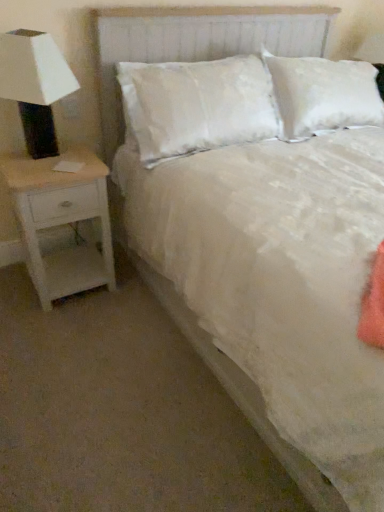
This screenshot has width=384, height=512. Describe the element at coordinates (194, 42) in the screenshot. I see `white textured headboard at center` at that location.

What is the approximate height of white matte lamp at left?

white matte lamp at left is 20.59 inches in height.

What do you see at coordinates (61, 220) in the screenshot? The width and height of the screenshot is (384, 512). I see `white wood nightstand at left` at bounding box center [61, 220].

Where is `white textured headboard at center`? white textured headboard at center is located at coordinates (194, 42).

Could you tell me if white wood nightstand at left is facing white textured headboard at center?

No, white wood nightstand at left is not turned towards white textured headboard at center.

From the image's perspective, which is below, white wood nightstand at left or white textured headboard at center?

From the image's view, white wood nightstand at left is below.

Is white wood nightstand at left thinner than white textured headboard at center?

No, white wood nightstand at left is not thinner than white textured headboard at center.

What's the angular difference between white wood nightstand at left and white textured headboard at center's facing directions?

The angle between the facing direction of white wood nightstand at left and the facing direction of white textured headboard at center is 0.00156 degrees.

Is point (44, 79) positioned before point (118, 118)?

Yes, it is.

Is white matte lamp at left smaller than white textured headboard at center?

Indeed, white matte lamp at left has a smaller size compared to white textured headboard at center.

Relative to white textured headboard at center, is white matte lamp at left in front or behind?

white matte lamp at left is positioned closer to the viewer than white textured headboard at center.

Between white textured headboard at center and white wood nightstand at left, which one has less height?

white wood nightstand at left.

Is point (143, 9) more distant than point (42, 196)?

Yes, it is.

Does white textured headboard at center have a larger size compared to white wood nightstand at left?

Yes, white textured headboard at center is bigger than white wood nightstand at left.

Where is `nightstand below the white textured headboard at center (from a real-world perspective)`? This screenshot has width=384, height=512. nightstand below the white textured headboard at center (from a real-world perspective) is located at coordinates (61, 220).

Considering the relative positions of white wood nightstand at left and white matte lamp at left in the image provided, is white wood nightstand at left to the right of white matte lamp at left from the viewer's perspective?

Indeed, white wood nightstand at left is positioned on the right side of white matte lamp at left.

Is white wood nightstand at left facing away from white matte lamp at left?

No, white matte lamp at left is not at the back of white wood nightstand at left.

Which object is more forward, white wood nightstand at left or white matte lamp at left?

white matte lamp at left is more forward.

Identify the location of nightstand below the white matte lamp at left (from a real-world perspective). (61, 220).

Which object is positioned more to the right, white matte lamp at left or white wood nightstand at left?

Positioned to the right is white wood nightstand at left.

Is white matte lamp at left outside of white wood nightstand at left?

white matte lamp at left lies outside white wood nightstand at left's area.

From a real-world perspective, is white matte lamp at left located beneath white wood nightstand at left?

No, from a real-world perspective, white matte lamp at left is not beneath white wood nightstand at left.

Is white matte lamp at left taller or shorter than white wood nightstand at left?

white matte lamp at left is shorter than white wood nightstand at left.

Is white textured headboard at center smaller than white matte lamp at left?

Incorrect, white textured headboard at center is not smaller in size than white matte lamp at left.

Is white textured headboard at center positioned before white matte lamp at left?

No, white textured headboard at center is behind white matte lamp at left.

Find the location of a particular element. This screenshot has height=512, width=384. headboard above the white matte lamp at left (from the image's perspective) is located at coordinates (194, 42).

Which of these two, white textured headboard at center or white matte lamp at left, is wider?

With larger width is white textured headboard at center.

This screenshot has height=512, width=384. I want to click on headboard that is above the white wood nightstand at left (from a real-world perspective), so click(x=194, y=42).

Locate an element on the screen. The height and width of the screenshot is (512, 384). lamp that appears below the white textured headboard at center (from the image's perspective) is located at coordinates (35, 85).

Estimate the real-world distances between objects in this image. Which object is further from white matte lamp at left, white textured headboard at center or white wood nightstand at left?

white textured headboard at center is positioned further to the anchor white matte lamp at left.

When comparing their distances from white textured headboard at center, does white matte lamp at left or white wood nightstand at left seem closer?

white matte lamp at left.

In the scene shown: Looking at the image, which one is located further to white textured headboard at center, white wood nightstand at left or white matte lamp at left?

white wood nightstand at left is positioned further to the anchor white textured headboard at center.

Considering their positions, is white wood nightstand at left positioned closer to white matte lamp at left than white textured headboard at center?

white wood nightstand at left lies closer to white matte lamp at left than the other object.

Which object lies further to the anchor point white wood nightstand at left, white matte lamp at left or white textured headboard at center?

Among the two, white textured headboard at center is located further to white wood nightstand at left.

Which object lies nearer to the anchor point white wood nightstand at left, white textured headboard at center or white matte lamp at left?

Among the two, white matte lamp at left is located nearer to white wood nightstand at left.

Where is `nightstand between white matte lamp at left and white textured headboard at center from left to right`? The image size is (384, 512). nightstand between white matte lamp at left and white textured headboard at center from left to right is located at coordinates (61, 220).